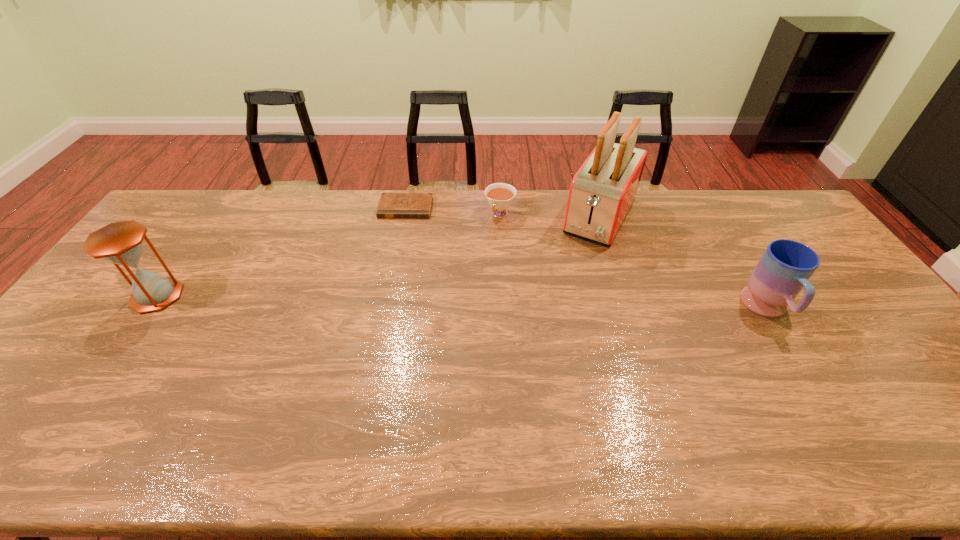
Identify the location of free space located on the spine side of the fourth object from right to left. (396, 252).

Identify the location of teacup that is at the far edge. (500, 196).

At what (x,y) coordinates should I click in order to perform the action: click on toaster that is positioned at the far edge. Please return your answer as a coordinate pair (x, y). Looking at the image, I should click on (603, 190).

Find the location of `diary that is at the far edge`. diary that is at the far edge is located at coordinates (391, 205).

Identify the location of object located at the left edge. The width and height of the screenshot is (960, 540). (120, 243).

Image resolution: width=960 pixels, height=540 pixels. In order to click on vacant space at the far edge in this screenshot , I will do `click(450, 197)`.

Identify the location of free space at the near edge of the desktop. (616, 402).

Locate an element on the screen. vacant space at the left edge of the desktop is located at coordinates (128, 322).

Find the location of a particular element. Image resolution: width=960 pixels, height=540 pixels. unoccupied area between the second tallest object and the toaster is located at coordinates (378, 256).

This screenshot has height=540, width=960. In order to click on vacant area that lies between the hourglass and the third object from left to right in this screenshot , I will do `click(328, 255)`.